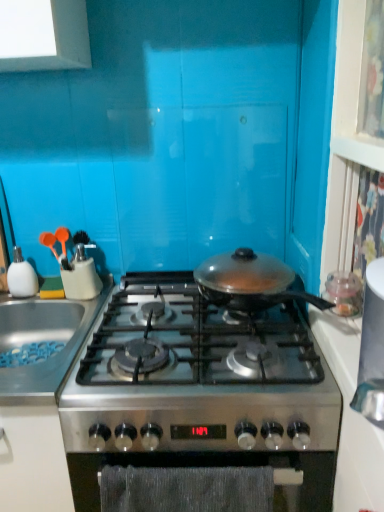
Question: Can you confirm if white glossy countertop at right is smaller than white glossy soap dispenser at left?

Choices:
 (A) yes
 (B) no

Answer: (B)

Question: Does white glossy countertop at right come in front of white glossy soap dispenser at left?

Choices:
 (A) no
 (B) yes

Answer: (B)

Question: From the image's perspective, would you say white glossy countertop at right is shown under white glossy soap dispenser at left?

Choices:
 (A) no
 (B) yes

Answer: (B)

Question: Does white glossy countertop at right have a lesser width compared to white glossy soap dispenser at left?

Choices:
 (A) yes
 (B) no

Answer: (B)

Question: Would you say white glossy countertop at right is outside white glossy soap dispenser at left?

Choices:
 (A) no
 (B) yes

Answer: (B)

Question: Based on their positions, is white glossy soap dispenser at left located to the left or right of stainless steel gas stove at center?

Choices:
 (A) right
 (B) left

Answer: (B)

Question: Looking at the image, does white glossy soap dispenser at left seem bigger or smaller compared to stainless steel gas stove at center?

Choices:
 (A) big
 (B) small

Answer: (B)

Question: From the image's perspective, relative to stainless steel gas stove at center, is white glossy soap dispenser at left above or below?

Choices:
 (A) above
 (B) below

Answer: (A)

Question: In the image, is white glossy soap dispenser at left positioned in front of or behind stainless steel gas stove at center?

Choices:
 (A) behind
 (B) front

Answer: (A)

Question: Considering the positions of textured gray oven at center and white glossy soap dispenser at left in the image, is textured gray oven at center taller or shorter than white glossy soap dispenser at left?

Choices:
 (A) short
 (B) tall

Answer: (B)

Question: From the image's perspective, is textured gray oven at center located above or below white glossy soap dispenser at left?

Choices:
 (A) below
 (B) above

Answer: (A)

Question: Is point (327, 484) positioned closer to the camera than point (23, 278)?

Choices:
 (A) closer
 (B) farther

Answer: (A)

Question: Visually, is textured gray oven at center positioned to the left or to the right of white glossy soap dispenser at left?

Choices:
 (A) right
 (B) left

Answer: (A)

Question: Would you say stainless steel sink at left is inside or outside white glossy soap dispenser at left?

Choices:
 (A) inside
 (B) outside

Answer: (B)

Question: In the image, is stainless steel sink at left positioned in front of or behind white glossy soap dispenser at left?

Choices:
 (A) behind
 (B) front

Answer: (B)